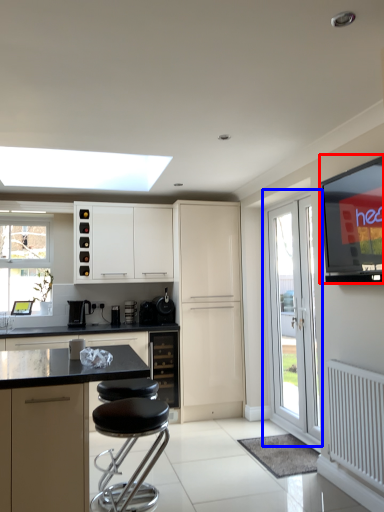
Question: Which of the following is the closest to the observer, window screen (highlighted by a red box) or door (highlighted by a blue box)?

Choices:
 (A) window screen
 (B) door

Answer: (A)